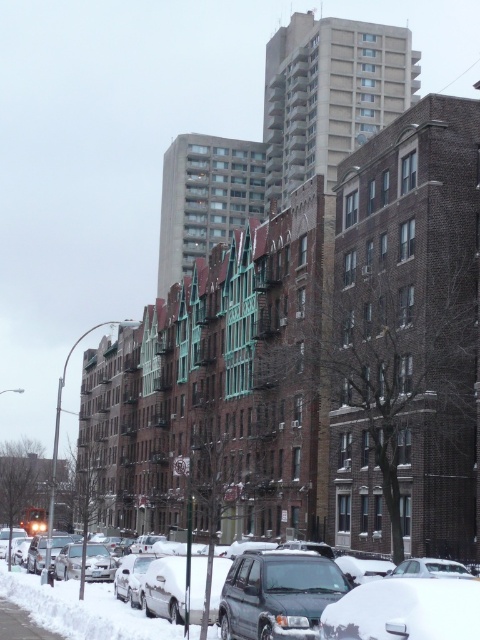
Does dark green matte suv at center have a lesser width compared to snow-covered suv at center?

Correct, dark green matte suv at center's width is less than snow-covered suv at center's.

Is dark green matte suv at center shorter than snow-covered suv at center?

Correct, dark green matte suv at center is not as tall as snow-covered suv at center.

Does point (314, 620) come behind point (29, 595)?

No, (314, 620) is in front of (29, 595).

Identify the location of dark green matte suv at center. Image resolution: width=480 pixels, height=640 pixels. (277, 595).